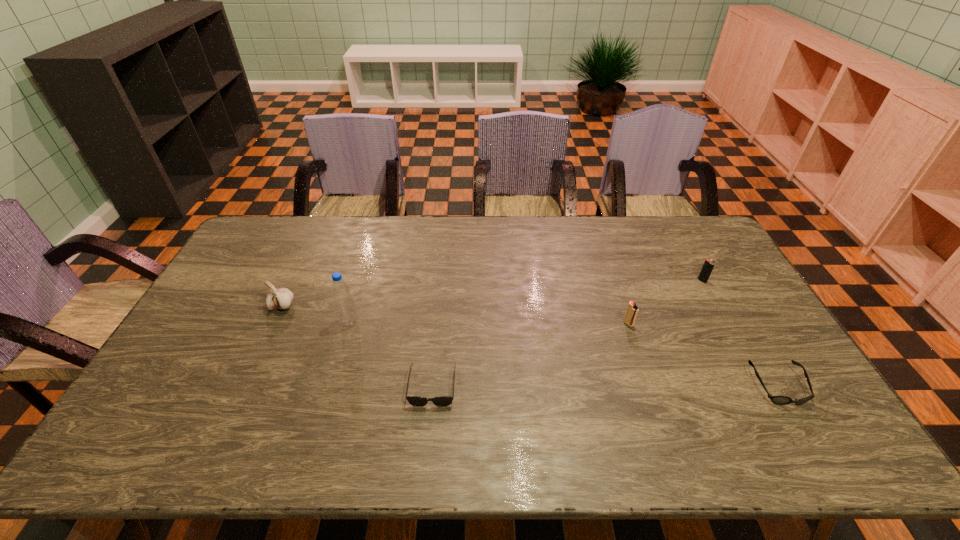
This screenshot has height=540, width=960. Find the location of `blank space at the left edge of the desktop`. blank space at the left edge of the desktop is located at coordinates point(202,376).

At what (x,y) coordinates should I click in order to perform the action: click on vacant space at the right edge of the desktop. Please return your answer as a coordinate pair (x, y). The image size is (960, 540). Looking at the image, I should click on (698, 257).

In the image, there is a desktop. Where is `free space at the near left corner`? This screenshot has width=960, height=540. free space at the near left corner is located at coordinates (130, 456).

Where is `free spot between the left igniter and the second farthest object`? free spot between the left igniter and the second farthest object is located at coordinates (455, 314).

Identify the location of vacant space that's between the leftmost object and the water bottle. The width and height of the screenshot is (960, 540). (316, 314).

The image size is (960, 540). What are the coordinates of `free area in between the fifth object from right to left and the right sunglasses` in the screenshot? It's located at (564, 354).

Where is `vacant space that's between the fifth object from right to left and the right igniter`? This screenshot has height=540, width=960. vacant space that's between the fifth object from right to left and the right igniter is located at coordinates (526, 301).

This screenshot has width=960, height=540. Find the location of `free space between the left sunglasses and the nearer igniter`. free space between the left sunglasses and the nearer igniter is located at coordinates (531, 355).

Where is `free space between the right igniter and the right sunglasses`? This screenshot has height=540, width=960. free space between the right igniter and the right sunglasses is located at coordinates (740, 333).

The height and width of the screenshot is (540, 960). Find the location of `free space between the third object from right to left and the farther igniter`. free space between the third object from right to left and the farther igniter is located at coordinates (665, 302).